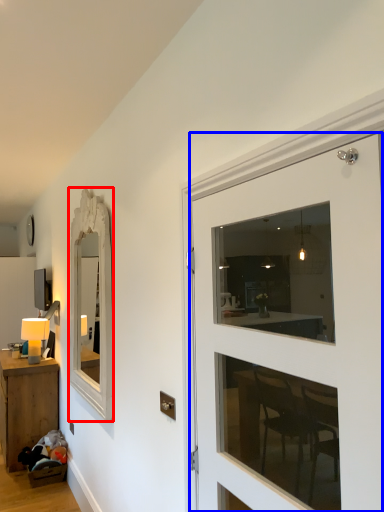
Question: Which object appears farthest to the camera in this image, mirror (highlighted by a red box) or door (highlighted by a blue box)?

Choices:
 (A) mirror
 (B) door

Answer: (A)